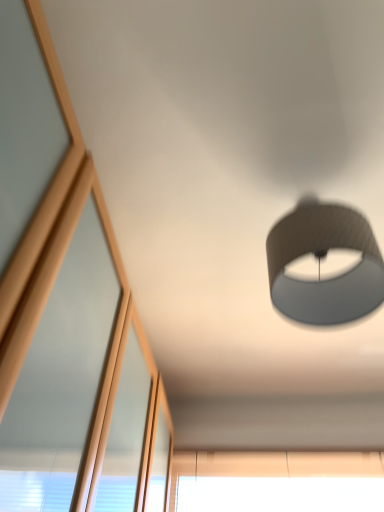
This screenshot has width=384, height=512. What do you see at coordinates (278, 494) in the screenshot?
I see `beige fabric window at lower center` at bounding box center [278, 494].

At what (x,y) coordinates should I click in order to perform the action: click on beige fabric window at lower center. Please return your answer as a coordinate pair (x, y). Looking at the image, I should click on (278, 494).

At what (x,y) coordinates should I click in order to perform the action: click on matte gray lampshade at upper right. Please return your answer as a coordinate pair (x, y). The width and height of the screenshot is (384, 512). Looking at the image, I should click on (320, 264).

Describe the element at coordinates (320, 264) in the screenshot. The height and width of the screenshot is (512, 384). I see `matte gray lampshade at upper right` at that location.

Find the location of a particular element. The image size is (384, 512). beige fabric window at lower center is located at coordinates (278, 494).

Is matte gray lampshade at upper right to the left or to the right of beige fabric window at lower center in the image?

matte gray lampshade at upper right is to the left of beige fabric window at lower center.

Between matte gray lampshade at upper right and beige fabric window at lower center, which one is positioned behind?

beige fabric window at lower center.

Which point is more distant from viewer, (339,284) or (278,506)?

The point (278,506) is farther.

From the image's perspective, would you say matte gray lampshade at upper right is shown under beige fabric window at lower center?

No, from the image's perspective, matte gray lampshade at upper right is not below beige fabric window at lower center.

From a real-world perspective, is matte gray lampshade at upper right beneath beige fabric window at lower center?

No, from a real-world perspective, matte gray lampshade at upper right is not under beige fabric window at lower center.

Considering the relative sizes of matte gray lampshade at upper right and beige fabric window at lower center in the image provided, is matte gray lampshade at upper right thinner than beige fabric window at lower center?

No.

Who is taller, matte gray lampshade at upper right or beige fabric window at lower center?

Standing taller between the two is matte gray lampshade at upper right.

Considering the sizes of objects matte gray lampshade at upper right and beige fabric window at lower center in the image provided, who is bigger, matte gray lampshade at upper right or beige fabric window at lower center?

matte gray lampshade at upper right is bigger.

Is matte gray lampshade at upper right completely or partially outside of beige fabric window at lower center?

Indeed, matte gray lampshade at upper right is completely outside beige fabric window at lower center.

Is matte gray lampshade at upper right far from beige fabric window at lower center?

matte gray lampshade at upper right is positioned a significant distance from beige fabric window at lower center.

Is matte gray lampshade at upper right looking in the opposite direction of beige fabric window at lower center?

Yes, beige fabric window at lower center is at the back of matte gray lampshade at upper right.

This screenshot has height=512, width=384. In order to click on lamp located in front of the beige fabric window at lower center in this screenshot , I will do click(320, 264).

Is beige fabric window at lower center at the right side of matte gray lampshade at upper right?

Yes.

Is beige fabric window at lower center positioned behind matte gray lampshade at upper right?

Yes, the depth of beige fabric window at lower center is greater than that of matte gray lampshade at upper right.

Is point (215, 498) closer or farther from the camera than point (356, 229)?

Clearly, point (215, 498) is more distant from the camera than point (356, 229).

From the image's perspective, is beige fabric window at lower center located above or below matte gray lampshade at upper right?

beige fabric window at lower center is situated lower than matte gray lampshade at upper right in the image.

From a real-world perspective, is beige fabric window at lower center located higher than matte gray lampshade at upper right?

Actually, beige fabric window at lower center is physically below matte gray lampshade at upper right in the real world.

Can you confirm if beige fabric window at lower center is thinner than matte gray lampshade at upper right?

Yes, beige fabric window at lower center is thinner than matte gray lampshade at upper right.

In the scene shown: Considering the sizes of objects beige fabric window at lower center and matte gray lampshade at upper right in the image provided, who is taller, beige fabric window at lower center or matte gray lampshade at upper right?

With more height is matte gray lampshade at upper right.

Is beige fabric window at lower center smaller than matte gray lampshade at upper right?

Yes.

Is matte gray lampshade at upper right located within beige fabric window at lower center?

That's incorrect, matte gray lampshade at upper right is not inside beige fabric window at lower center.

Is beige fabric window at lower center next to matte gray lampshade at upper right?

No, beige fabric window at lower center is not in contact with matte gray lampshade at upper right.

Is beige fabric window at lower center aimed at matte gray lampshade at upper right?

Yes.

At what (x,y) coordinates should I click in order to perform the action: click on lamp that appears above the beige fabric window at lower center (from a real-world perspective). Please return your answer as a coordinate pair (x, y). The height and width of the screenshot is (512, 384). Looking at the image, I should click on (320, 264).

Where is `window below the matte gray lampshade at upper right (from the image's perspective)`? window below the matte gray lampshade at upper right (from the image's perspective) is located at coordinates (278, 494).

Locate an element on the screen. Image resolution: width=384 pixels, height=512 pixels. lamp on the left of beige fabric window at lower center is located at coordinates (320, 264).